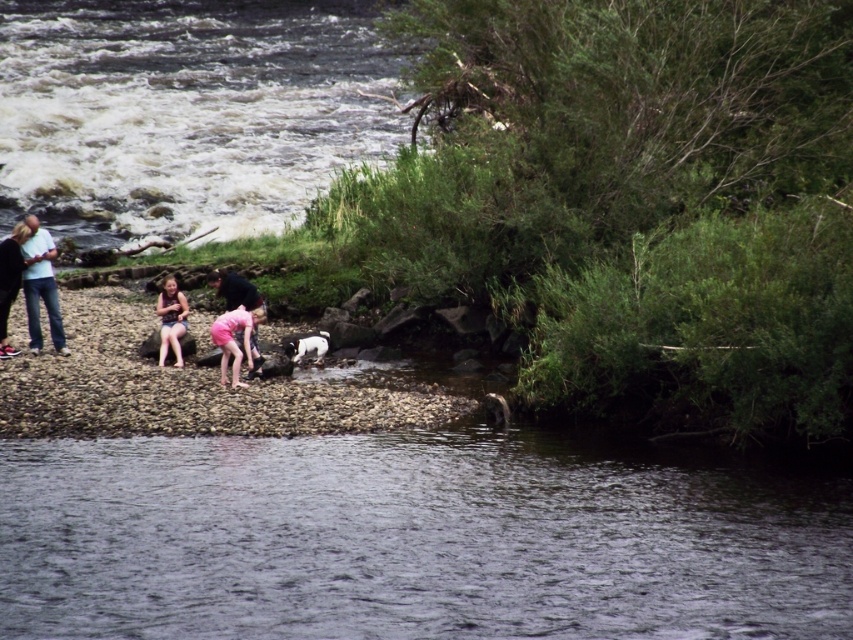
You are a photographer positioned at the riverside edge. You want to capture a photo that includes both the dark blue shirt at center and the black and white fur dog at center. Based on their sizes, which one should you frame closer to the camera to ensure both fit in the shot?

The dark blue shirt at center has a lesser width compared to the black and white fur dog at center. To include both in the photo, you should frame the dark blue shirt at center closer to the camera since it is smaller and requires less space, allowing the larger black and white fur dog at center to fit in the background.

You are a photographer standing on the riverbank and want to capture a photo of the white frothy water at lower left and the pink fabric dress at center. Which object is closer to the left edge of your camera frame?

The white frothy water at lower left is positioned on the left side of the pink fabric dress at center, so it is closer to the left edge of the camera frame.

You are standing at the edge of the riverbank and want to cross to the other side. There is a point marked at coordinates (184,112). Based on the scene description, what is the safest path to take to avoid the strong currents?

The safest path would be to avoid the white frothy water at lower left, which indicates strong currents. Instead, move towards areas with calmer, darker reflective water away from the marked point.